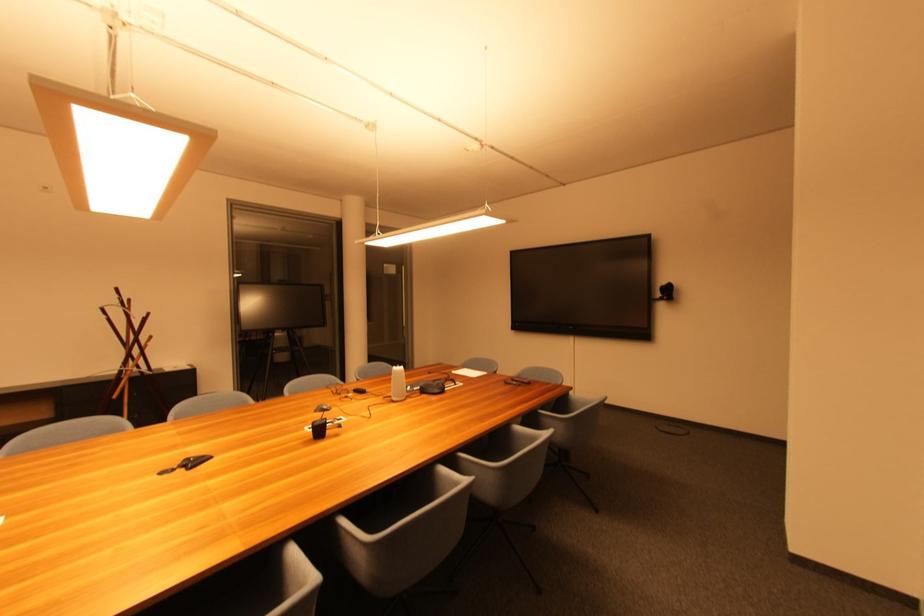
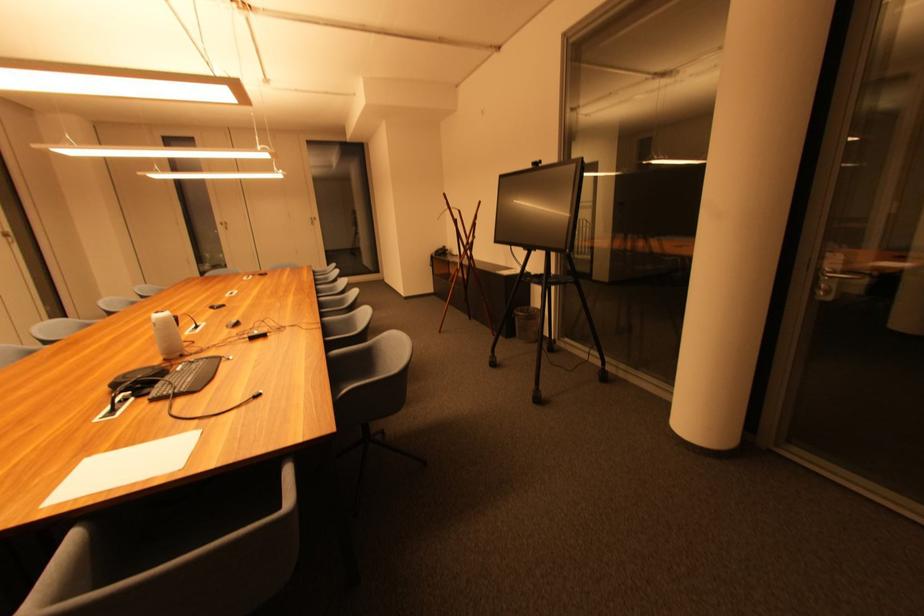
In the second image, find the point that corresponds to pixel 424 389 in the first image.

(184, 371)